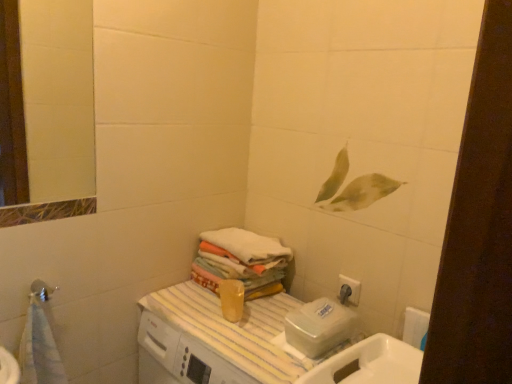
Image resolution: width=512 pixels, height=384 pixels. What do you see at coordinates (370, 363) in the screenshot? I see `white glossy sink at lower right` at bounding box center [370, 363].

The width and height of the screenshot is (512, 384). In order to click on matte silver shower head at lower left in this screenshot , I will do `click(42, 290)`.

Who is more distant, matte silver shower head at lower left or white glossy sink at lower right?

matte silver shower head at lower left is behind.

Between matte silver shower head at lower left and white glossy sink at lower right, which one has smaller size?

matte silver shower head at lower left.

From a real-world perspective, between matte silver shower head at lower left and white glossy sink at lower right, who is vertically higher?

matte silver shower head at lower left, from a real-world perspective.

Does white matte toilet paper at lower right have a lesser width compared to white soft towel at center?

Yes, white matte toilet paper at lower right is thinner than white soft towel at center.

Is white soft towel at center inside white matte toilet paper at lower right?

That's incorrect, white soft towel at center is not inside white matte toilet paper at lower right.

Are white matte toilet paper at lower right and white soft towel at center making contact?

white matte toilet paper at lower right and white soft towel at center are not in contact.

Is white glossy sink at lower right to the left or to the right of white soft towel at center in the image?

From the image, it's evident that white glossy sink at lower right is to the right of white soft towel at center.

Is white soft towel at center located within white glossy sink at lower right?

No, white soft towel at center is not surrounded by white glossy sink at lower right.

In the scene shown: How different are the orientations of white glossy sink at lower right and white soft towel at center in degrees?

The angle between the facing direction of white glossy sink at lower right and the facing direction of white soft towel at center is 0.354 degrees.

In the scene shown: Looking at the image, does white glossy sink at lower right seem bigger or smaller compared to white soft towel at center?

Considering their sizes, white glossy sink at lower right takes up more space than white soft towel at center.

Which of these two, white soft towel at center or white matte toilet paper at lower right, is thinner?

white matte toilet paper at lower right.

Which is behind, point (281, 272) or point (423, 315)?

The point (281, 272) is farther.

Which is more to the right, white soft towel at center or white matte toilet paper at lower right?

From the viewer's perspective, white matte toilet paper at lower right appears more on the right side.

Based on their sizes in the image, would you say matte silver shower head at lower left is bigger or smaller than white matte toilet paper at lower right?

In the image, matte silver shower head at lower left appears to be smaller than white matte toilet paper at lower right.

Between matte silver shower head at lower left and white matte toilet paper at lower right, which one appears on the right side from the viewer's perspective?

Positioned to the right is white matte toilet paper at lower right.

From the image's perspective, relative to white matte toilet paper at lower right, is matte silver shower head at lower left above or below?

matte silver shower head at lower left is situated higher than white matte toilet paper at lower right in the image.

Considering the points (44, 290) and (418, 325), which point is behind, point (44, 290) or point (418, 325)?

Positioned behind is point (44, 290).

Is white matte toilet paper at lower right far away from white glossy sink at lower right?

That's not correct — white matte toilet paper at lower right is a little close to white glossy sink at lower right.

Is white matte toilet paper at lower right taller or shorter than white glossy sink at lower right?

In the image, white matte toilet paper at lower right appears to be shorter than white glossy sink at lower right.

From a real-world perspective, which object stands above the other?

white matte toilet paper at lower right.

Is white matte toilet paper at lower right in front of or behind white glossy sink at lower right in the image?

In the image, white matte toilet paper at lower right appears behind white glossy sink at lower right.

Can matte silver shower head at lower left be found inside white glossy sink at lower right?

That's incorrect, matte silver shower head at lower left is not inside white glossy sink at lower right.

Find the location of a particular element. shower positioned vertically above the white glossy sink at lower right (from a real-world perspective) is located at coordinates (42, 290).

Measure the distance from white glossy sink at lower right to matte silver shower head at lower left.

The distance of white glossy sink at lower right from matte silver shower head at lower left is 33.53 inches.

From the image's perspective, is white glossy sink at lower right on matte silver shower head at lower left?

No, from the image's perspective, white glossy sink at lower right is not above matte silver shower head at lower left.

You are a GUI agent. You are given a task and a screenshot of the screen. Output one action in this format:
    pyautogui.click(x=<x>, y=<y>)
    Task: Click on the sink below the matte silver shower head at lower left (from the image's perspective)
    This screenshot has height=384, width=512.
    Given the screenshot: What is the action you would take?
    pyautogui.click(x=370, y=363)

Find the location of `bath towel that appears on the left of white matte toilet paper at lower right`. bath towel that appears on the left of white matte toilet paper at lower right is located at coordinates (239, 259).

Considering their positions, is white matte toilet paper at lower right positioned closer to white glossy sink at lower right than white soft towel at center?

Among the two, white matte toilet paper at lower right is located nearer to white glossy sink at lower right.

Which object lies nearer to the anchor point matte silver shower head at lower left, white matte toilet paper at lower right or white soft towel at center?

white soft towel at center is positioned closer to the anchor matte silver shower head at lower left.

Estimate the real-world distances between objects in this image. Which object is closer to white soft towel at center, matte silver shower head at lower left or white matte toilet paper at lower right?

The object closer to white soft towel at center is white matte toilet paper at lower right.

Which object lies nearer to the anchor point matte silver shower head at lower left, white matte toilet paper at lower right or white glossy sink at lower right?

Among the two, white glossy sink at lower right is located nearer to matte silver shower head at lower left.

Which object lies nearer to the anchor point white matte toilet paper at lower right, white glossy sink at lower right or white soft towel at center?

white glossy sink at lower right lies closer to white matte toilet paper at lower right than the other object.

Based on their spatial positions, is white matte toilet paper at lower right or matte silver shower head at lower left closer to white glossy sink at lower right?

Based on the image, white matte toilet paper at lower right appears to be nearer to white glossy sink at lower right.

Considering their positions, is white glossy sink at lower right positioned further to white soft towel at center than white matte toilet paper at lower right?

white matte toilet paper at lower right is positioned further to the anchor white soft towel at center.

Estimate the real-world distances between objects in this image. Which object is further from matte silver shower head at lower left, white soft towel at center or white matte toilet paper at lower right?

white matte toilet paper at lower right is positioned further to the anchor matte silver shower head at lower left.

Image resolution: width=512 pixels, height=384 pixels. Identify the location of toilet paper between white glossy sink at lower right and white soft towel at center from front to back. (415, 327).

I want to click on bath towel situated between matte silver shower head at lower left and white glossy sink at lower right from left to right, so click(239, 259).

Find the location of a particular element. sink between matte silver shower head at lower left and white matte toilet paper at lower right is located at coordinates (370, 363).

You are a GUI agent. You are given a task and a screenshot of the screen. Output one action in this format:
    pyautogui.click(x=<x>, y=<y>)
    Task: Click on the bath towel situated between matte silver shower head at lower left and white matte toilet paper at lower right from left to right
    The height and width of the screenshot is (384, 512).
    Given the screenshot: What is the action you would take?
    (239, 259)